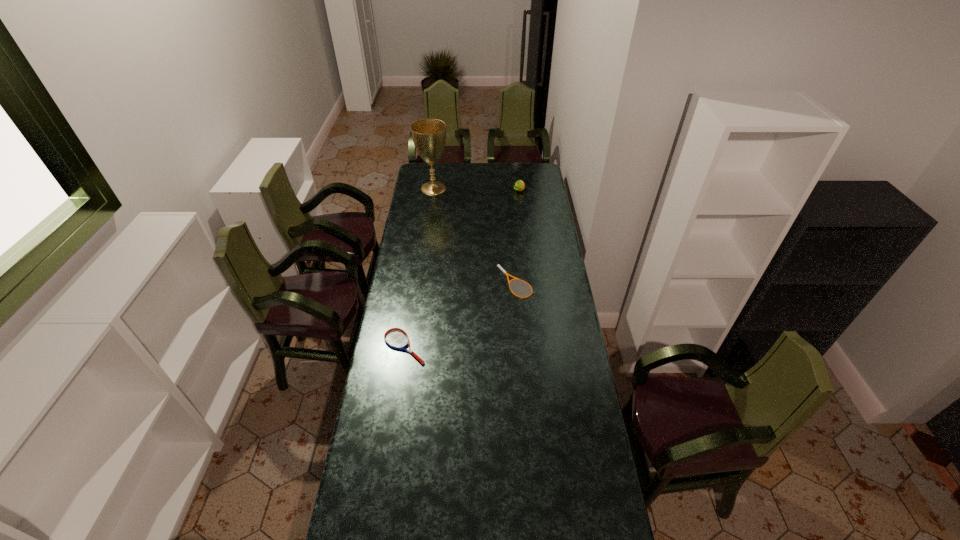
Point out which object is positioned as the third nearest to the left tennis racket. Please provide its 2D coordinates. Your answer should be formatted as a tuple, i.e. [(x, y)], where the tuple contains the x and y coordinates of a point satisfying the conditions above.

[(519, 185)]

Find the location of a particular element. The height and width of the screenshot is (540, 960). vacant position in the image that satisfies the following two spatial constraints: 1. on the front side of the tallest object; 2. on the left side of the farther tennis racket is located at coordinates (420, 282).

Identify the location of vacant space that satisfies the following two spatial constraints: 1. on the back side of the nearest object; 2. on the left side of the farther tennis racket. (414, 282).

Locate an element on the screen. Image resolution: width=960 pixels, height=540 pixels. free point that satisfies the following two spatial constraints: 1. on the front side of the third farthest object; 2. on the right side of the tallest object is located at coordinates (420, 282).